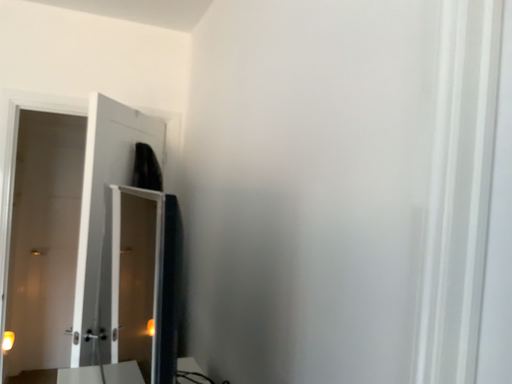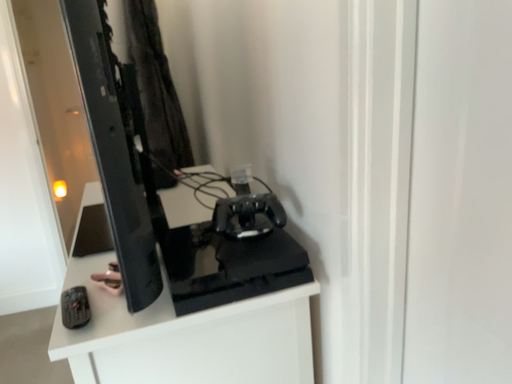
Question: How did the camera likely rotate when shooting the video?

Choices:
 (A) rotated upward
 (B) rotated downward

Answer: (B)